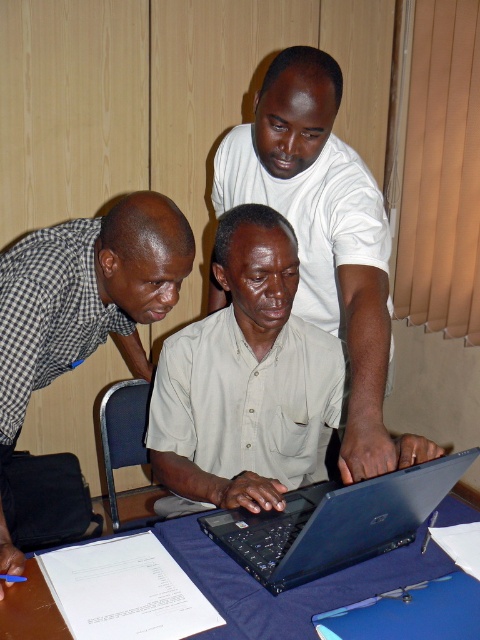
Question: Does checkered fabric shirt at left have a smaller size compared to black plastic laptop at center?

Choices:
 (A) no
 (B) yes

Answer: (A)

Question: Which object is the farthest from the white matte shirt at center?

Choices:
 (A) blue fabric table at center
 (B) checkered fabric shirt at left

Answer: (A)

Question: Which point appears farthest from the camera in this image?

Choices:
 (A) (315, 272)
 (B) (420, 481)
 (C) (24, 378)
 (D) (171, 540)

Answer: (A)

Question: Does white matte shirt at center appear over blue fabric table at center?

Choices:
 (A) yes
 (B) no

Answer: (A)

Question: Which is nearer to the white matte shirt at center?

Choices:
 (A) black plastic laptop at center
 (B) checkered fabric shirt at left

Answer: (A)

Question: Does black plastic laptop at center appear on the left side of blue fabric table at center?

Choices:
 (A) no
 (B) yes

Answer: (A)